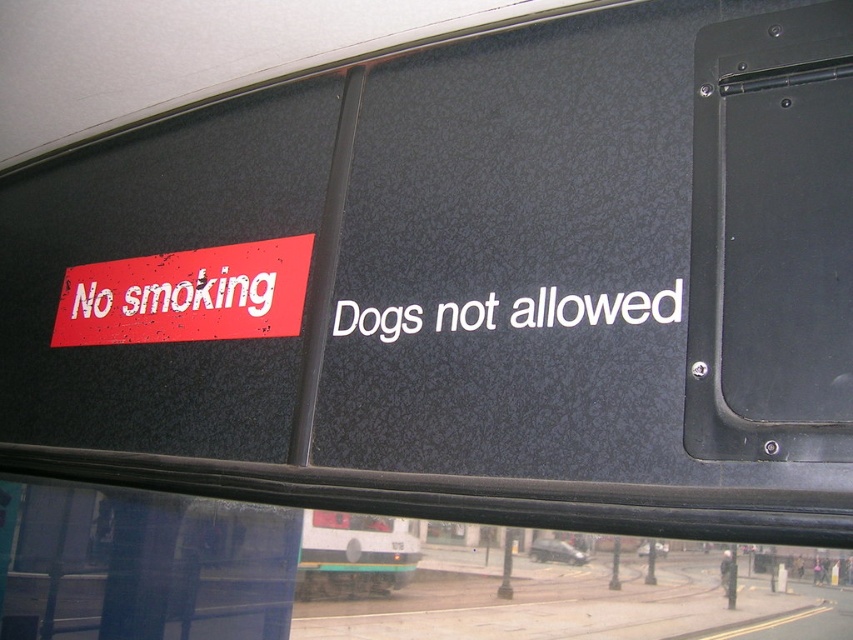
Can you confirm if red matte sign at upper left is positioned to the right of white plastic text at center?

In fact, red matte sign at upper left is to the left of white plastic text at center.

Is red matte sign at upper left smaller than white plastic text at center?

Incorrect, red matte sign at upper left is not smaller in size than white plastic text at center.

This screenshot has width=853, height=640. What are the coordinates of `red matte sign at upper left` in the screenshot? It's located at (186, 296).

Find the location of `red matte sign at upper left`. red matte sign at upper left is located at coordinates (186, 296).

What are the coordinates of `red matte sign at upper left` in the screenshot? It's located at (186, 296).

Does red matte sign at upper left have a greater height compared to white plastic bus at lower center?

No.

Describe the element at coordinates (186, 296) in the screenshot. This screenshot has height=640, width=853. I see `red matte sign at upper left` at that location.

Identify the location of red matte sign at upper left. (186, 296).

Is point (517, 321) positioned before point (312, 525)?

Yes, point (517, 321) is in front of point (312, 525).

Is point (451, 328) more distant than point (366, 536)?

No.

Locate an element on the screen. This screenshot has width=853, height=640. white plastic text at center is located at coordinates (595, 308).